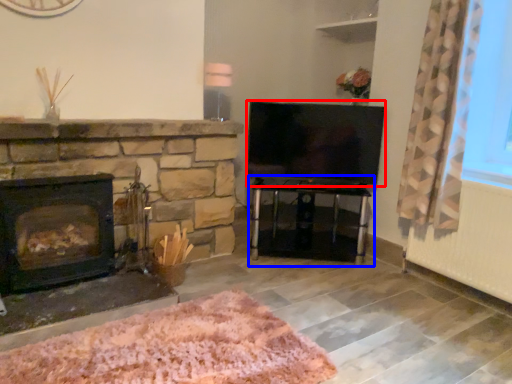
Question: Which object is further to the camera taking this photo, television (highlighted by a red box) or table (highlighted by a blue box)?

Choices:
 (A) television
 (B) table

Answer: (A)